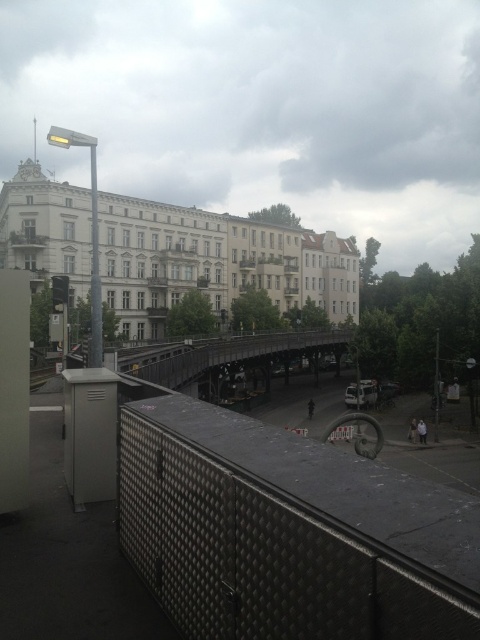
Question: Among these objects, which one is nearest to the camera?

Choices:
 (A) white matte jacket at lower center
 (B) metallic gray bridge at center

Answer: (B)

Question: Observing the image, what is the correct spatial positioning of metallic gray bridge at center in reference to white matte jacket at lower center?

Choices:
 (A) below
 (B) above

Answer: (B)

Question: Is white matte jacket at lower center below light brown leather jacket at lower right?

Choices:
 (A) yes
 (B) no

Answer: (B)

Question: Which is nearer to the metallic gray bridge at center?

Choices:
 (A) white matte jacket at lower center
 (B) light brown leather jacket at lower right

Answer: (B)

Question: Which object is positioned farthest from the white matte jacket at lower center?

Choices:
 (A) light brown leather jacket at lower right
 (B) metallic gray bridge at center

Answer: (B)

Question: Is metallic gray bridge at center further to camera compared to white matte jacket at lower center?

Choices:
 (A) yes
 (B) no

Answer: (B)